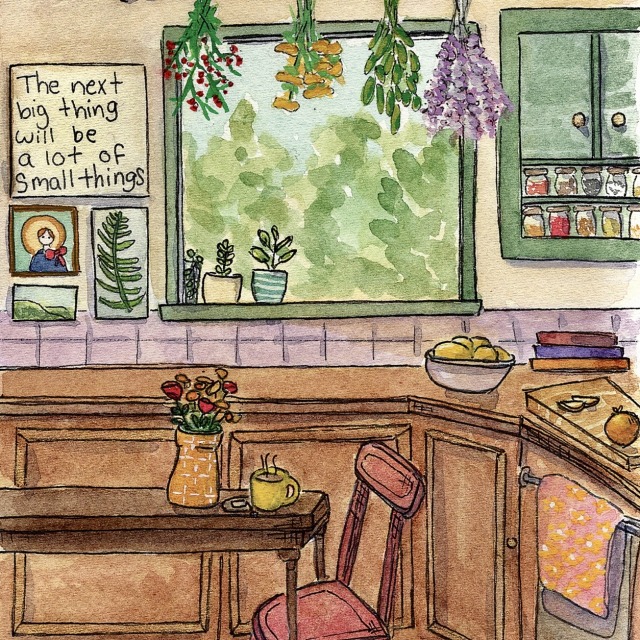
The image size is (640, 640). What are the coordinates of `knob` in the screenshot? It's located at (512, 544).